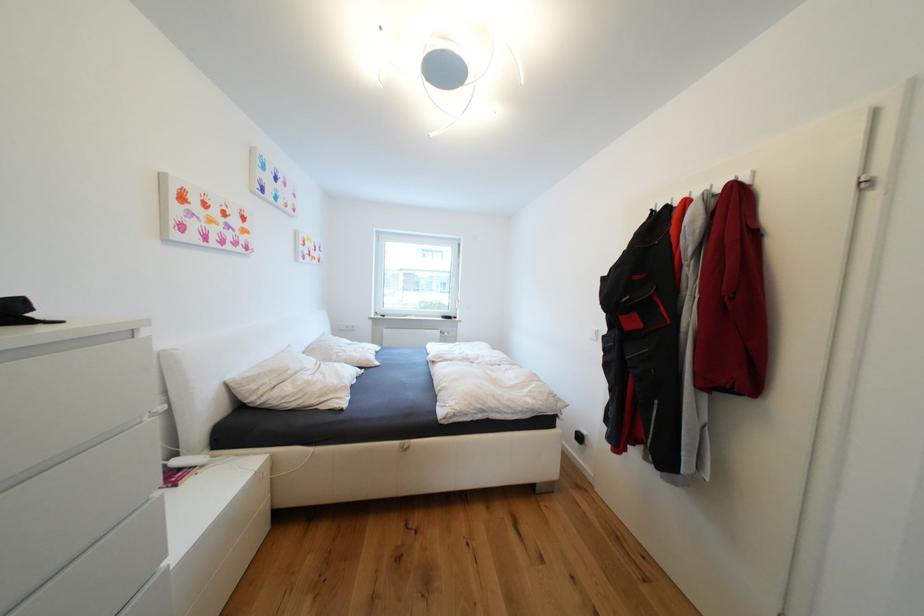
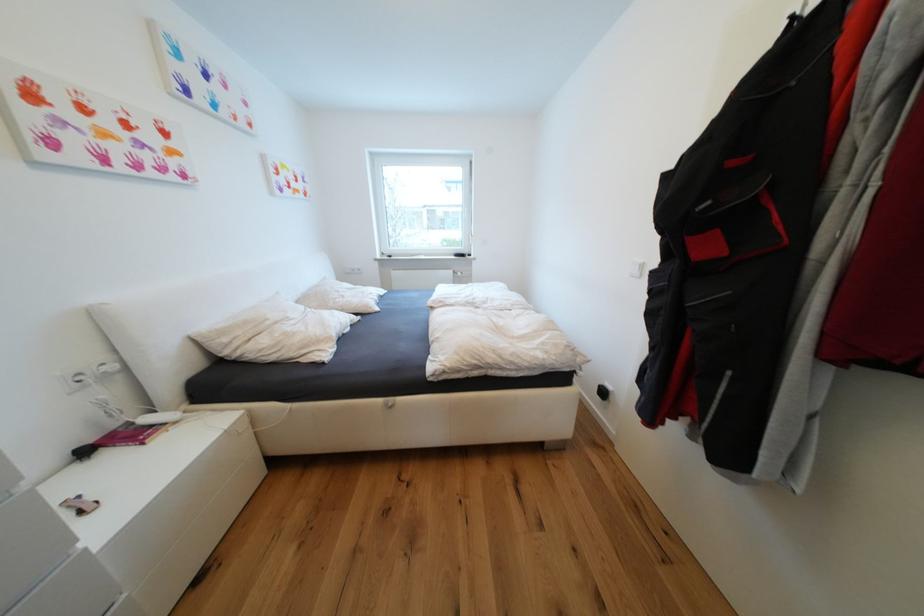
Find the pixel in the second image that matches the point at 168,408 in the first image.

(119, 369)